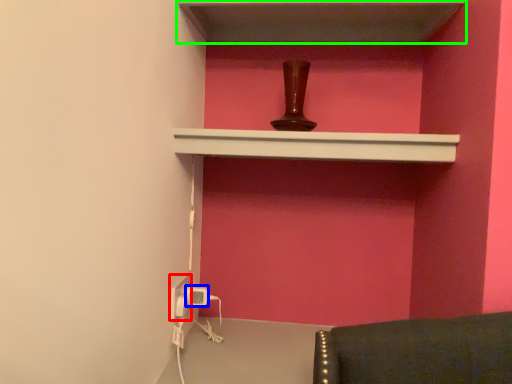
Question: Considering the real-world distances, which object is closest to electric outlet (highlighted by a red box)? electric outlet (highlighted by a blue box) or shelf (highlighted by a green box).

Choices:
 (A) electric outlet
 (B) shelf

Answer: (A)